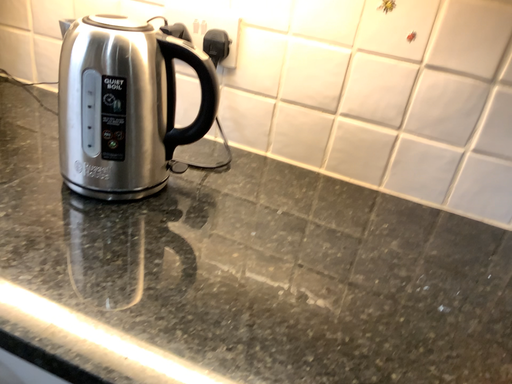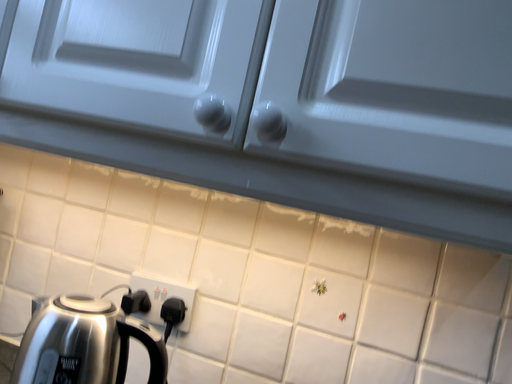
Question: Which way did the camera rotate in the video?

Choices:
 (A) rotated downward
 (B) rotated upward

Answer: (B)